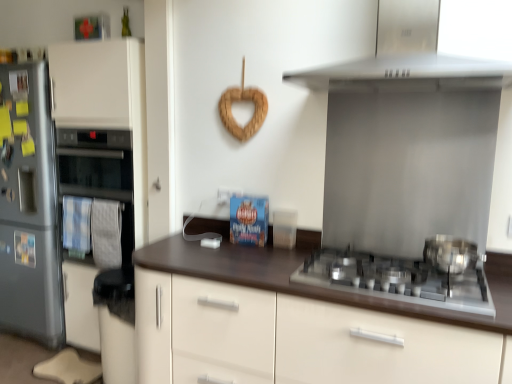
Question: Considering their positions, is brown matte countertop at center located in front of or behind stainless steel range hood at upper center?

Choices:
 (A) front
 (B) behind

Answer: (B)

Question: From a real-world perspective, is brown matte countertop at center physically located above or below stainless steel range hood at upper center?

Choices:
 (A) below
 (B) above

Answer: (A)

Question: Considering the real-world distances, which object is closest to the satin silver fridge at left?

Choices:
 (A) stainless steel range hood at upper center
 (B) satin white oven at left
 (C) brown matte countertop at center
 (D) satin silver gas stove at lower right
 (E) polished stainless steel pot at right

Answer: (B)

Question: Based on their relative distances, which object is farther from the satin white oven at left?

Choices:
 (A) brown matte countertop at center
 (B) satin silver gas stove at lower right
 (C) satin silver fridge at left
 (D) polished stainless steel pot at right
 (E) stainless steel range hood at upper center

Answer: (D)